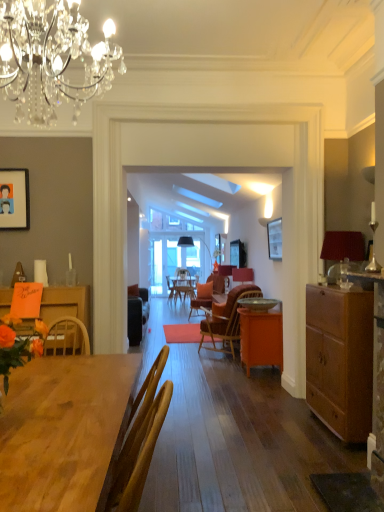
Image resolution: width=384 pixels, height=512 pixels. Describe the element at coordinates (64, 431) in the screenshot. I see `wooden table at lower left` at that location.

In order to face wooden table at lower left, should I rotate leftwards or rightwards?

Turn left by 14.586 degrees to look at wooden table at lower left.

The width and height of the screenshot is (384, 512). I want to click on crystal chandelier at upper center, the second lamp viewed from the back, so click(x=52, y=58).

The image size is (384, 512). What do you see at coordinates (275, 239) in the screenshot?
I see `white glossy picture frame at upper center` at bounding box center [275, 239].

Measure the distance between white glossy picture frame at upper center and camera.

white glossy picture frame at upper center is 4.25 meters away from camera.

Where is `dark brown wood cabinet at right`? dark brown wood cabinet at right is located at coordinates (340, 359).

Find the location of a particular element. Image resolution: width=384 pixels, height=512 pixels. wooden table at lower left is located at coordinates (64, 431).

Is white glossy picture frame at upper center far from matte orange flowers at left?

white glossy picture frame at upper center is positioned a significant distance from matte orange flowers at left.

How different are the orientations of white glossy picture frame at upper center and matte orange flowers at left in degrees?

The angular difference between white glossy picture frame at upper center and matte orange flowers at left is 91 degrees.

Identify the location of picture frame behind the matte orange flowers at left. (275, 239).

Considering the relative sizes of white glossy picture frame at upper center and matte orange flowers at left in the image provided, is white glossy picture frame at upper center thinner than matte orange flowers at left?

Correct, the width of white glossy picture frame at upper center is less than that of matte orange flowers at left.

Is matte orange flowers at left wider than metallic gold bowl at center?

No.

From the image's perspective, who appears lower, matte orange flowers at left or metallic gold bowl at center?

metallic gold bowl at center, from the image's perspective.

Is matte orange flowers at left inside or outside of metallic gold bowl at center?

matte orange flowers at left is spatially situated outside metallic gold bowl at center.

From a real-world perspective, between matte orange flowers at left and metallic gold bowl at center, who is vertically lower?

From a 3D spatial view, metallic gold bowl at center is below.

From a real-world perspective, does wooden chair at center stand above dark brown wood cabinet at right?

No.

What's the angular difference between wooden chair at center and dark brown wood cabinet at right's facing directions?

The facing directions of wooden chair at center and dark brown wood cabinet at right are 0.476 degrees apart.

Is wooden chair at center thinner than dark brown wood cabinet at right?

In fact, wooden chair at center might be wider than dark brown wood cabinet at right.

Does wooden chair at center have a larger size compared to dark brown wood cabinet at right?

Yes, wooden chair at center is bigger than dark brown wood cabinet at right.

Can you tell me how much metallic gold bowl at center and white glossy picture frame at upper center differ in facing direction?

The angle between the facing direction of metallic gold bowl at center and the facing direction of white glossy picture frame at upper center is 0.605 degrees.

Consider the image. Is metallic gold bowl at center directly adjacent to white glossy picture frame at upper center?

No.

Does metallic gold bowl at center turn towards white glossy picture frame at upper center?

No.

Which of these two, metallic gold bowl at center or white glossy picture frame at upper center, stands shorter?

With less height is metallic gold bowl at center.

Considering the relative sizes of white glossy picture frame at upper center and metallic gold bowl at center in the image provided, is white glossy picture frame at upper center shorter than metallic gold bowl at center?

No, white glossy picture frame at upper center is not shorter than metallic gold bowl at center.

From a real-world perspective, which object stands above the other?

white glossy picture frame at upper center, from a real-world perspective.

Which is behind, point (278, 250) or point (274, 303)?

Positioned behind is point (274, 303).

I want to click on picture frame that appears above the metallic gold bowl at center (from a real-world perspective), so click(275, 239).

Which object is closer to the camera taking this photo, dark brown wood cabinet at right or red fabric lampshade at center?

dark brown wood cabinet at right is in front.

From the picture: Is dark brown wood cabinet at right positioned with its back to red fabric lampshade at center?

No, dark brown wood cabinet at right is not facing away from red fabric lampshade at center.

Is dark brown wood cabinet at right touching red fabric lampshade at center?

No, dark brown wood cabinet at right is not with red fabric lampshade at center.

From a real-world perspective, is dark brown wood cabinet at right located higher than red fabric lampshade at center?

No, from a real-world perspective, dark brown wood cabinet at right is not on top of red fabric lampshade at center.

Is wooden table at lower left far away from white glossy picture frame at upper center?

Absolutely, wooden table at lower left is distant from white glossy picture frame at upper center.

Which object is closer to the camera taking this photo, wooden table at lower left or white glossy picture frame at upper center?

Positioned in front is wooden table at lower left.

Can you confirm if wooden table at lower left is taller than white glossy picture frame at upper center?

Indeed, wooden table at lower left has a greater height compared to white glossy picture frame at upper center.

At what (x,y) coordinates should I click in order to perform the action: click on flower lying in front of the white glossy picture frame at upper center. Please return your answer as a coordinate pair (x, y). The width and height of the screenshot is (384, 512). Looking at the image, I should click on (18, 345).

Identify the location of round table lying below the matte orange flowers at left (from the image's perspective). The width and height of the screenshot is (384, 512). (258, 303).

Consider the image. Which object lies nearer to the anchor point wooden table at lower left, dark brown wood cabinet at right or matte orange flowers at left?

Based on the image, matte orange flowers at left appears to be nearer to wooden table at lower left.

Based on their spatial positions, is matte orange flowers at left or wooden chair at center further from dark brown wood cabinet at right?

wooden chair at center is positioned further to the anchor dark brown wood cabinet at right.

In the scene shown: Estimate the real-world distances between objects in this image. Which object is further from matte orange flowers at left, wooden chair at center or red fabric lampshade at center?

Based on the image, red fabric lampshade at center appears to be further to matte orange flowers at left.

When comparing their distances from white glossy picture frame at upper center, does orange matte cabinet at center or matte orange flowers at left seem closer?

Among the two, orange matte cabinet at center is located nearer to white glossy picture frame at upper center.

From the image, which object appears to be nearer to orange matte cabinet at center, metallic gold bowl at center or red velvet lampshade at right, placed as the first lamp when sorted from back to front?

metallic gold bowl at center lies closer to orange matte cabinet at center than the other object.

Considering their positions, is red fabric lampshade at center positioned further to orange matte cabinet at center than metallic gold bowl at center?

red fabric lampshade at center is further to orange matte cabinet at center.

Considering their positions, is red fabric lampshade at center positioned further to crystal chandelier at upper center, positioned as the second lamp in bottom-to-top order, than wooden chair at center?

The object further to crystal chandelier at upper center, positioned as the second lamp in bottom-to-top order, is red fabric lampshade at center.

Estimate the real-world distances between objects in this image. Which object is further from dark brown wood cabinet at right, wooden table at lower left or orange matte cabinet at center?

The object further to dark brown wood cabinet at right is wooden table at lower left.

Identify the location of picture frame positioned between dark brown wood cabinet at right and metallic gold bowl at center from near to far. The height and width of the screenshot is (512, 384). (x=275, y=239).

Locate an element on the screen. flower between crystal chandelier at upper center, which ranks as the 2th lamp in right-to-left order, and wooden table at lower left in the up-down direction is located at coordinates (18, 345).

Locate an element on the screen. The width and height of the screenshot is (384, 512). cabinetry between wooden table at lower left and white glossy picture frame at upper center from front to back is located at coordinates (340, 359).

Locate an element on the screen. Image resolution: width=384 pixels, height=512 pixels. cabinetry between crystal chandelier at upper center, the second lamp viewed from the back, and red velvet lampshade at right, acting as the 1th lamp starting from the right, along the z-axis is located at coordinates tap(340, 359).